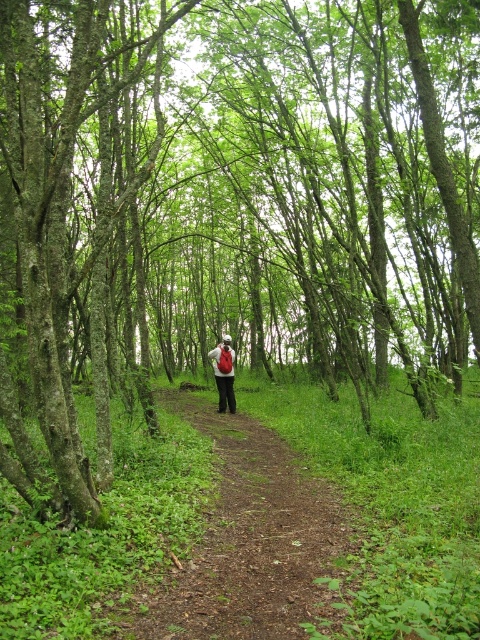
Based on the photo, you are standing at the edge of the forest and want to find the brown dirt path at center. According to the coordinates provided, in which direction should you walk to reach it?

The brown dirt path at center is located at coordinates point (x=250, y=541). Since the coordinates are based on a 2D plane where the origin is at the bottom left corner, you should walk towards the upper right direction to reach it.